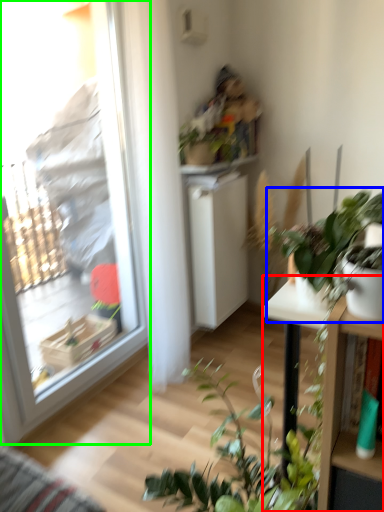
Question: Based on their relative distances, which object is nearer to table (highlighted by a red box)? Choose from houseplant (highlighted by a blue box) and window (highlighted by a green box).

Choices:
 (A) houseplant
 (B) window

Answer: (A)